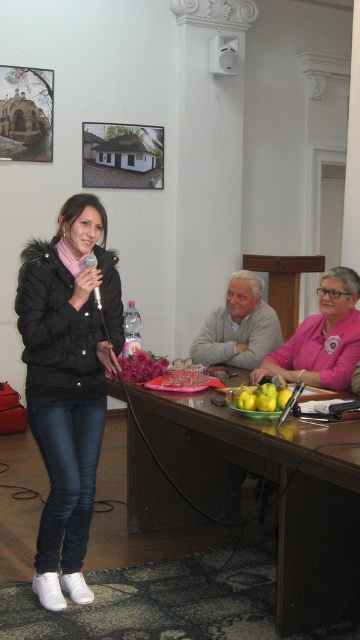
You are a photographer at the event and need to capture a clear shot of both the black puffer jacket at left and the matte black microphone at center. Which object should you focus on first to ensure both are in focus?

The black puffer jacket at left is in front of the matte black microphone at center, so you should focus on the black puffer jacket at left first to ensure both are in focus.

Consider the image. You are organizing a small event and need to ensure there is enough space between the black puffer jacket at left and the matte black microphone at center for a 1.2 meter wide equipment cart. Based on the scene description, can the cart fit between them?

The black puffer jacket at left might be wider than matte black microphone at center, so there is uncertainty about the available space. It is safer to assume the cart may not fit without more precise measurements.

You are a stagehand who needs to place a 1.5 meter long table between the black puffer jacket at left and the gray woolen sweater at center. Can the table fit between them without overlapping either?

The distance between the black puffer jacket at left and the gray woolen sweater at center is 1.23 meters, which is shorter than the table length of 1.5 meters. Therefore, the table cannot fit between them without overlapping.